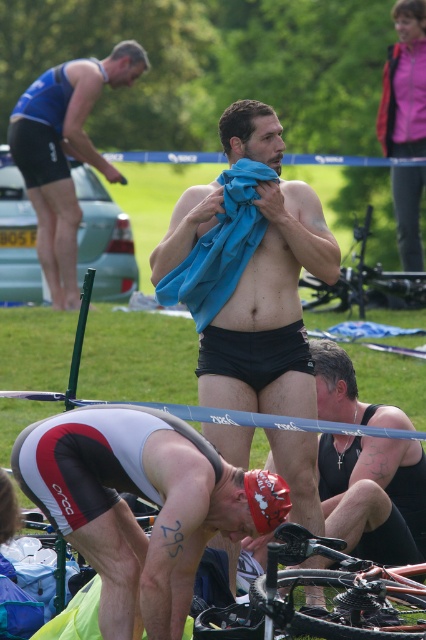
You are an athlete at the triathlon transition area. You need to quickly grab your black matte shorts at center before mounting your shiny metallic bicycle at lower center. Based on their positions, which item is closer to you?

The black matte shorts at center is closer to you because it is further to the viewer than the shiny metallic bicycle at lower center, meaning you can reach it before the bicycle.

You are an athlete at the triathlon transition area. You need to quickly grab your matte blue shorts at upper left before mounting your shiny metallic bicycle at lower center. Given the distance between them, do you think you can reach your shorts and get on the bicycle within 10 seconds?

The matte blue shorts at upper left and shiny metallic bicycle at lower center are 32.44 feet apart. Assuming an average running speed of 9 feet per second, covering 32.44 feet would take approximately 3.6 seconds. This leaves ample time to grab the shorts and mount the bicycle within the 10 seconds.